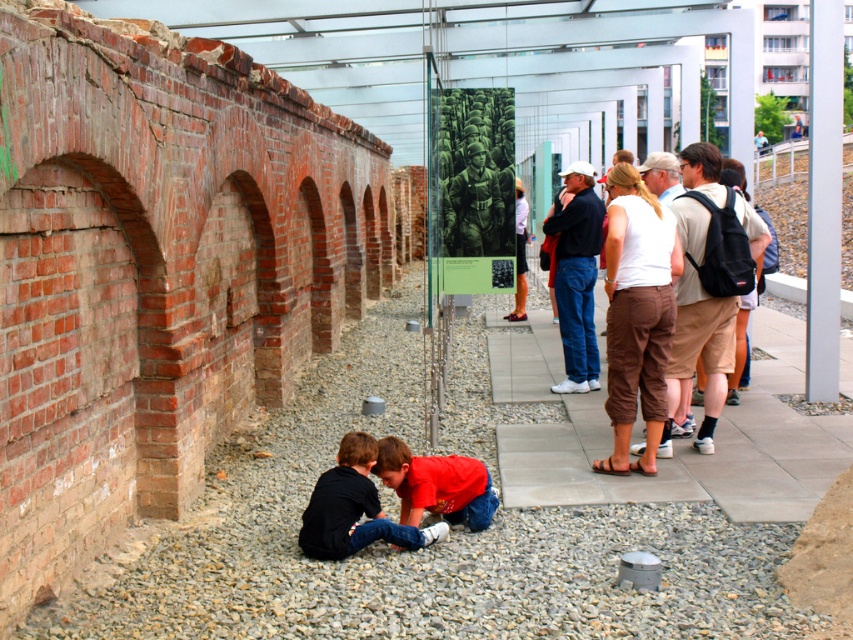
Who is positioned more to the right, gray gravel at lower center or brown cotton shorts at center-right?

brown cotton shorts at center-right

Which is in front, point (267, 474) or point (635, 452)?

Positioned in front is point (267, 474).

Find the location of a particular element. This screenshot has height=640, width=853. gray gravel at lower center is located at coordinates (418, 552).

Does khaki shorts at center have a larger size compared to black cotton shirt at lower center?

Yes.

Is khaki shorts at center to the right of black cotton shirt at lower center from the viewer's perspective?

Correct, you'll find khaki shorts at center to the right of black cotton shirt at lower center.

What do you see at coordinates (698, 300) in the screenshot?
I see `khaki shorts at center` at bounding box center [698, 300].

Find the location of `khaki shorts at center`. khaki shorts at center is located at coordinates (698, 300).

Which is in front, point (724, 346) or point (564, 266)?

Point (724, 346)

The height and width of the screenshot is (640, 853). Identify the location of khaki shorts at center. (698, 300).

The width and height of the screenshot is (853, 640). What do you see at coordinates (698, 300) in the screenshot?
I see `khaki shorts at center` at bounding box center [698, 300].

I want to click on khaki shorts at center, so click(698, 300).